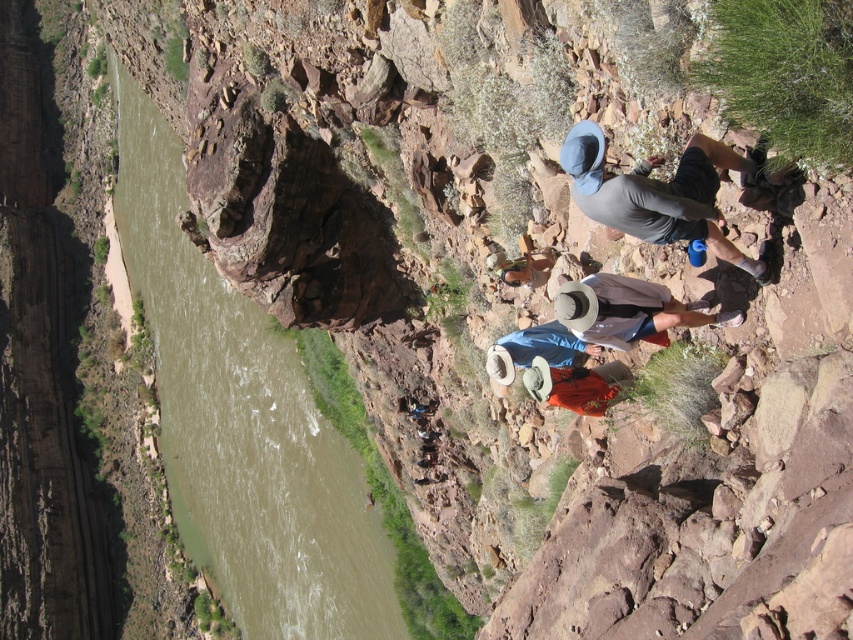
You are a photographer positioned at the edge of the cliff and want to capture both the brown rock at center and the gray fabric hat at upper right in your shot. Which object will appear closer to the camera in the photo?

The brown rock at center will appear closer to the camera in the photo because it is further to the viewer than the gray fabric hat at upper right.

You are a hiker trying to locate your friend who is wearing a gray fabric hat at upper right. You are currently standing near the brown rock at center. In which direction should you move to find your friend?

The gray fabric hat at upper right is to the right of the brown rock at center, so you should move to your right to find your friend.